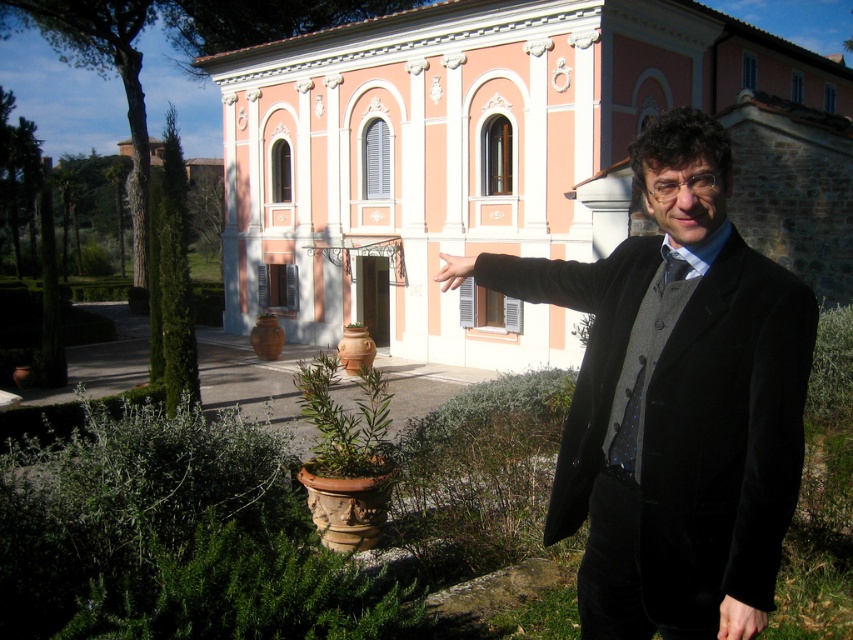
Which is above, pink stucco building at center or smooth skin hand at center?

pink stucco building at center

Locate an element on the screen. The width and height of the screenshot is (853, 640). pink stucco building at center is located at coordinates (503, 161).

Is point (788, 403) positioned before point (733, 609)?

That is True.

The width and height of the screenshot is (853, 640). In order to click on velvet black coat at center in this screenshot , I will do `click(676, 400)`.

Does point (711, 509) come in front of point (738, 618)?

No, it is not.

This screenshot has width=853, height=640. In order to click on velvet black coat at center in this screenshot , I will do `click(676, 400)`.

Is velvet black coat at center positioned before smooth skin hand at center?

Yes, velvet black coat at center is in front of smooth skin hand at center.

Is velvet black coat at center bigger than smooth skin hand at center?

Correct, velvet black coat at center is larger in size than smooth skin hand at center.

Is point (701, 198) positioned behind point (444, 273)?

That is False.

The height and width of the screenshot is (640, 853). What are the coordinates of `velvet black coat at center` in the screenshot? It's located at (676, 400).